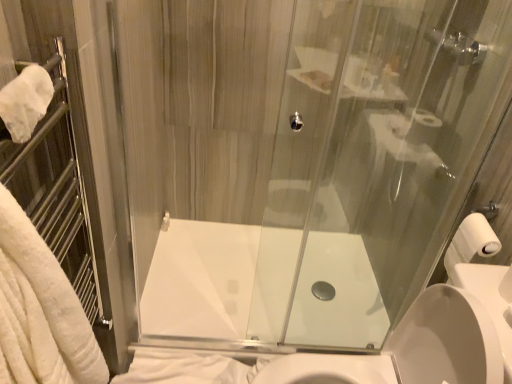
Question: Based on their sizes in the image, would you say white soft towel at lower left, marked as the first bath towel in a bottom-to-top arrangement, is bigger or smaller than white glossy bath at center?

Choices:
 (A) big
 (B) small

Answer: (B)

Question: Considering the positions of white soft towel at lower left, marked as the first bath towel in a bottom-to-top arrangement, and white glossy bath at center in the image, is white soft towel at lower left, marked as the first bath towel in a bottom-to-top arrangement, taller or shorter than white glossy bath at center?

Choices:
 (A) short
 (B) tall

Answer: (B)

Question: Which object is the closest to the white soft towel at lower left, the 2th bath towel viewed from the top?

Choices:
 (A) white glossy sink at center
 (B) transparent glass shower door at center
 (C) white soft towel at left, which appears as the 1th bath towel when viewed from the top
 (D) white matte toilet paper at right
 (E) white matte towel bar at upper left

Answer: (A)

Question: Based on their relative distances, which object is nearer to the white matte toilet paper at right?

Choices:
 (A) white glossy bath at center
 (B) white matte towel bar at upper left
 (C) transparent glass shower door at center
 (D) white glossy sink at center
 (E) white soft towel at lower left, positioned as the second bath towel in front-to-back order

Answer: (D)